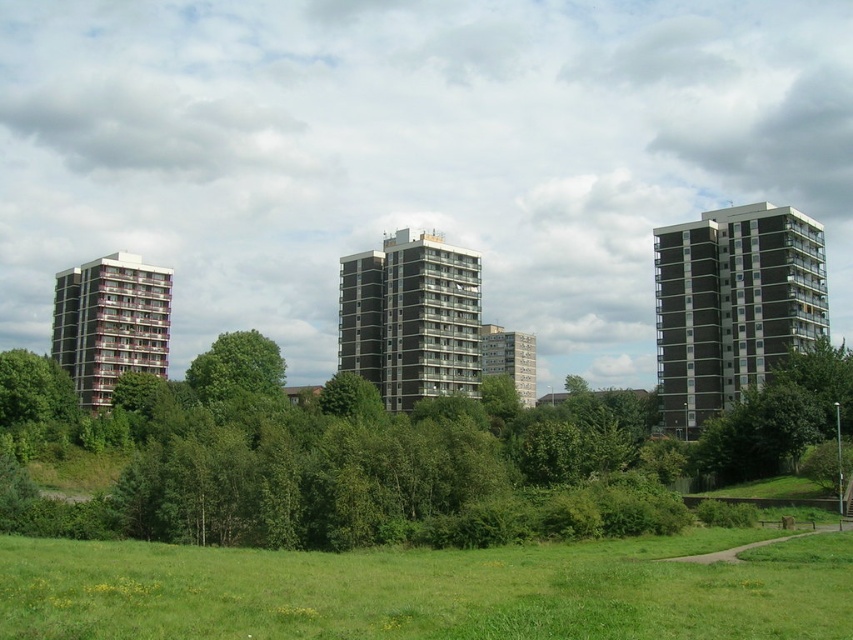
Question: Which of the following is the farthest from the observer?

Choices:
 (A) brown brick building at right
 (B) green grassy field at lower center
 (C) green leafy tree at center

Answer: (C)

Question: Which point appears closest to the camera in this image?

Choices:
 (A) (827, 284)
 (B) (160, 586)

Answer: (B)

Question: Considering the relative positions of dark gray concrete building at center and green leafy tree at center in the image provided, where is dark gray concrete building at center located with respect to green leafy tree at center?

Choices:
 (A) left
 (B) right

Answer: (B)

Question: Among these objects, which one is nearest to the camera?

Choices:
 (A) green grassy field at lower center
 (B) green leafy tree at center

Answer: (A)

Question: Is dark gray concrete building at center in front of matte pink balconies at left?

Choices:
 (A) yes
 (B) no

Answer: (A)

Question: Can you confirm if green grassy field at lower center is positioned to the right of brown brick building at right?

Choices:
 (A) no
 (B) yes

Answer: (A)